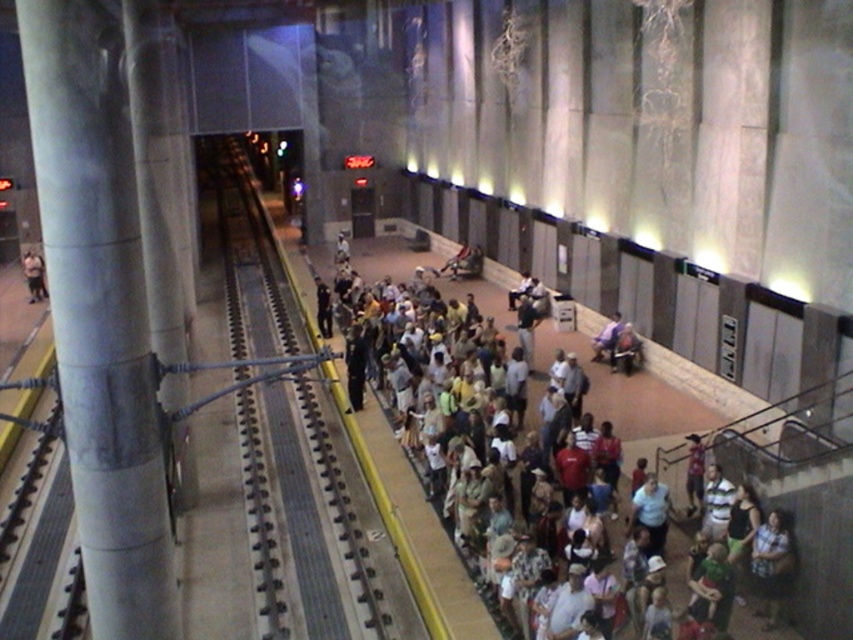
Who is more distant from viewer, (245, 412) or (30, 269)?

Point (30, 269)

Can you confirm if smooth metal track at center is wider than matte black backpack at left?

Correct, the width of smooth metal track at center exceeds that of matte black backpack at left.

Is point (218, 208) closer to camera compared to point (42, 269)?

No, (218, 208) is further to viewer.

The height and width of the screenshot is (640, 853). Identify the location of smooth metal track at center. (312, 518).

Which is in front, point (85, 99) or point (317, 252)?

Positioned in front is point (85, 99).

Which is more to the left, smooth concrete pillar at left or white cotton shirt at center?

smooth concrete pillar at left

Does point (47, 176) come in front of point (639, 400)?

Yes.

Identify the location of smooth concrete pillar at left. tap(99, 310).

Between white cotton shirt at center and matte black backpack at left, which one has less height?

With less height is matte black backpack at left.

Can you confirm if white cotton shirt at center is bigger than matte black backpack at left?

Yes.

Where is `white cotton shirt at center`? The image size is (853, 640). white cotton shirt at center is located at coordinates (647, 408).

You are a GUI agent. You are given a task and a screenshot of the screen. Output one action in this format:
    pyautogui.click(x=<x>, y=<y>)
    Task: Click on the white cotton shirt at center
    
    Given the screenshot: What is the action you would take?
    pyautogui.click(x=647, y=408)